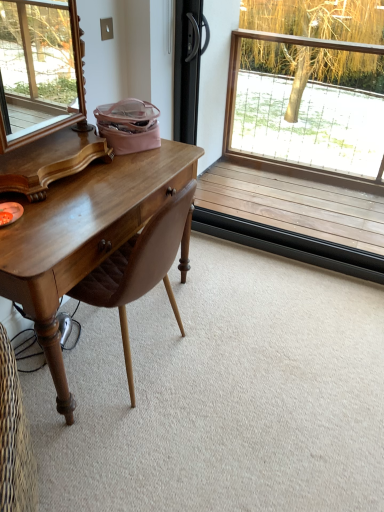
Question: Is wooden frame at upper right outside of brown leather chair at left?

Choices:
 (A) no
 (B) yes

Answer: (B)

Question: Does wooden frame at upper right have a smaller size compared to brown leather chair at left?

Choices:
 (A) yes
 (B) no

Answer: (A)

Question: Does wooden frame at upper right touch brown leather chair at left?

Choices:
 (A) no
 (B) yes

Answer: (A)

Question: From a real-world perspective, does wooden frame at upper right stand above brown leather chair at left?

Choices:
 (A) no
 (B) yes

Answer: (B)

Question: Does wooden frame at upper right have a lesser width compared to brown leather chair at left?

Choices:
 (A) yes
 (B) no

Answer: (A)

Question: Is wooden frame at upper right facing away from brown leather chair at left?

Choices:
 (A) no
 (B) yes

Answer: (A)

Question: Is brown leather chair at left outside wooden frame at upper right?

Choices:
 (A) yes
 (B) no

Answer: (A)

Question: Does brown leather chair at left have a larger size compared to wooden frame at upper right?

Choices:
 (A) yes
 (B) no

Answer: (A)

Question: Does brown leather chair at left appear on the left side of wooden frame at upper right?

Choices:
 (A) yes
 (B) no

Answer: (A)

Question: Is wooden frame at upper right surrounded by brown leather chair at left?

Choices:
 (A) no
 (B) yes

Answer: (A)

Question: Can you confirm if brown leather chair at left is shorter than wooden frame at upper right?

Choices:
 (A) no
 (B) yes

Answer: (B)

Question: Is brown leather chair at left wider than wooden frame at upper right?

Choices:
 (A) no
 (B) yes

Answer: (B)

Question: Considering their positions, is wooden frame at upper right located in front of or behind brown leather chair at left?

Choices:
 (A) front
 (B) behind

Answer: (B)